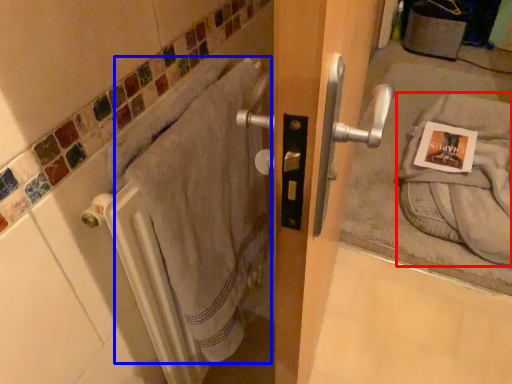
Question: Which point is closer to the camera, bath towel (highlighted by a red box) or bath towel (highlighted by a blue box)?

Choices:
 (A) bath towel
 (B) bath towel

Answer: (B)